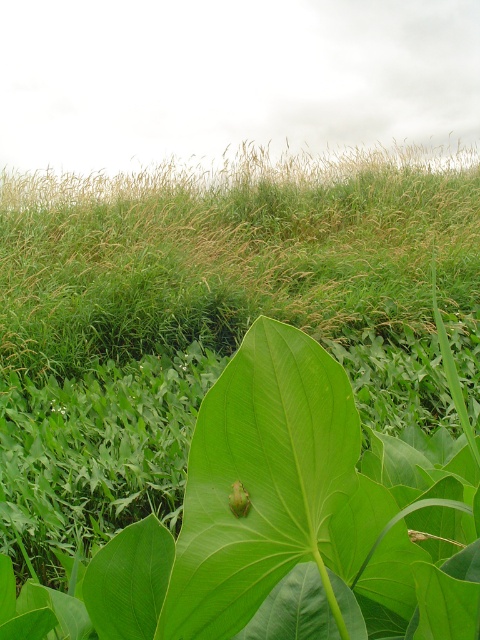
Can you confirm if green grass at center is positioned to the right of green matte leaf at center?

No, green grass at center is not to the right of green matte leaf at center.

Which is above, green grass at center or green matte leaf at center?

green grass at center

Is point (477, 182) positioned behind point (257, 534)?

That is True.

Locate an element on the screen. The height and width of the screenshot is (640, 480). green grass at center is located at coordinates (229, 250).